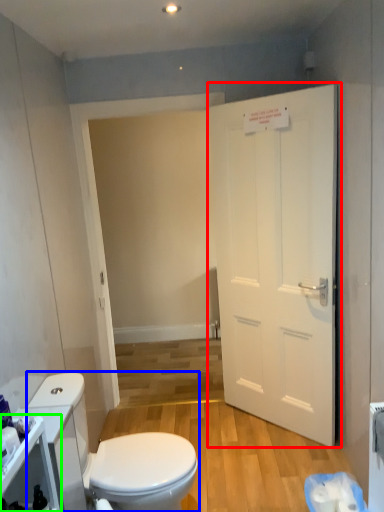
Question: Based on their relative distances, which object is nearer to door (highlighted by a red box)? Choose from toilet (highlighted by a blue box) and cabinetry (highlighted by a green box).

Choices:
 (A) toilet
 (B) cabinetry

Answer: (A)